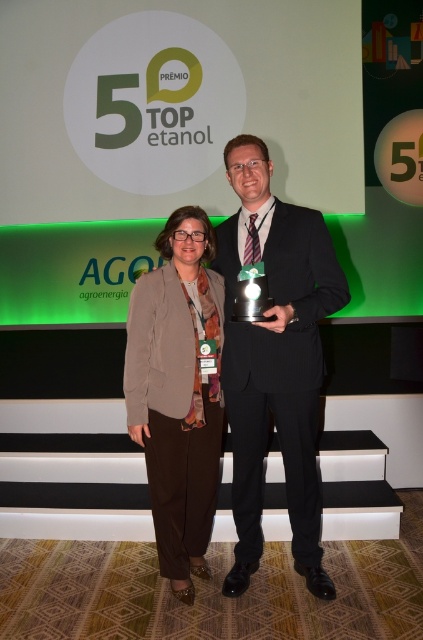
You are a photographer at the event and need to adjust the lighting so that the black pinstripe suit at center and the brown fabric jacket at center are both well illuminated. Based on their positions, which one is on the right side and should have the light adjusted towards it first?

The black pinstripe suit at center is positioned on the right side of the brown fabric jacket at center, so the light should be adjusted towards the black pinstripe suit at center first.

Based on the scene description, can you determine if the black pinstripe suit at center is wider than the brown fabric jacket at center?

The black pinstripe suit at center is wider than the brown fabric jacket at center according to the description provided.